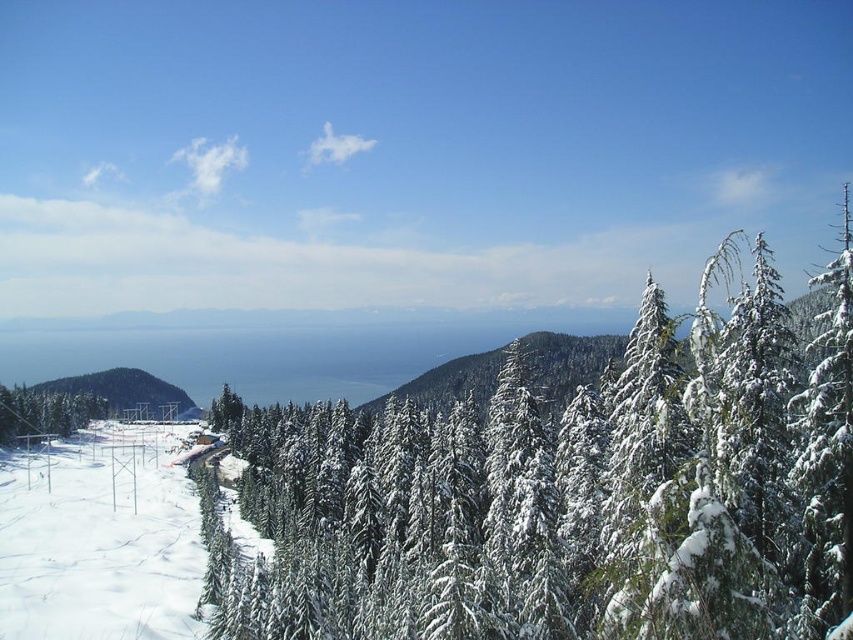
Does white snow-covered tree at center have a lesser width compared to snow-covered hill at center?

No.

Which is below, white snow-covered tree at center or snow-covered hill at center?

snow-covered hill at center is lower down.

Where is `white snow-covered tree at center`? Image resolution: width=853 pixels, height=640 pixels. white snow-covered tree at center is located at coordinates (566, 493).

This screenshot has width=853, height=640. What do you see at coordinates (566, 493) in the screenshot?
I see `white snow-covered tree at center` at bounding box center [566, 493].

Locate an element on the screen. The image size is (853, 640). white snow-covered tree at center is located at coordinates (566, 493).

Is white snow ski slope at lower left below white snow-covered tree at lower left?

Correct, white snow ski slope at lower left is located below white snow-covered tree at lower left.

Where is `white snow ski slope at lower left`? This screenshot has height=640, width=853. white snow ski slope at lower left is located at coordinates (99, 538).

Which is in front, point (97, 534) or point (86, 397)?

Point (97, 534)

Find the location of a particular element. The image size is (853, 640). white snow ski slope at lower left is located at coordinates (99, 538).